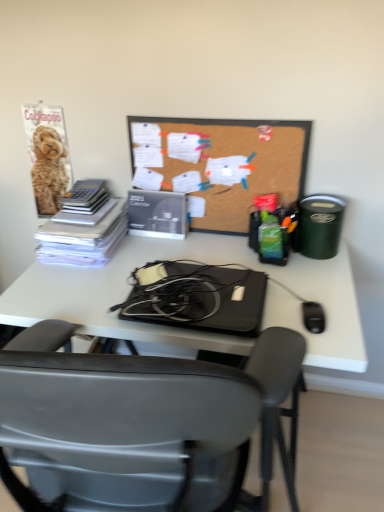
The height and width of the screenshot is (512, 384). I want to click on vacant space that is in between black matte laptop at center and white paper stack at left, so click(x=138, y=264).